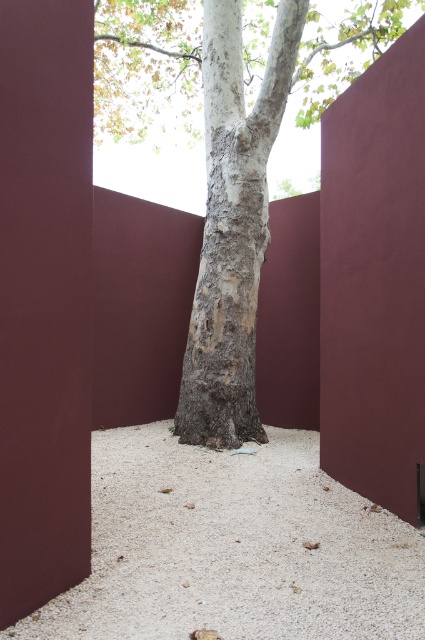
Question: Is gray textured bark at center behind smooth bark tree at center?

Choices:
 (A) yes
 (B) no

Answer: (B)

Question: Does white gravel at center have a lesser width compared to smooth bark tree at center?

Choices:
 (A) yes
 (B) no

Answer: (B)

Question: Which point is closer to the camera?

Choices:
 (A) (181, 400)
 (B) (214, 541)

Answer: (B)

Question: From the image, what is the correct spatial relationship of white gravel at center in relation to smooth bark tree at center?

Choices:
 (A) below
 (B) above

Answer: (A)

Question: Among these points, which one is farthest from the camera?

Choices:
 (A) (65, 602)
 (B) (229, 225)

Answer: (B)

Question: Which point is closer to the camera?

Choices:
 (A) (184, 625)
 (B) (181, 397)

Answer: (A)